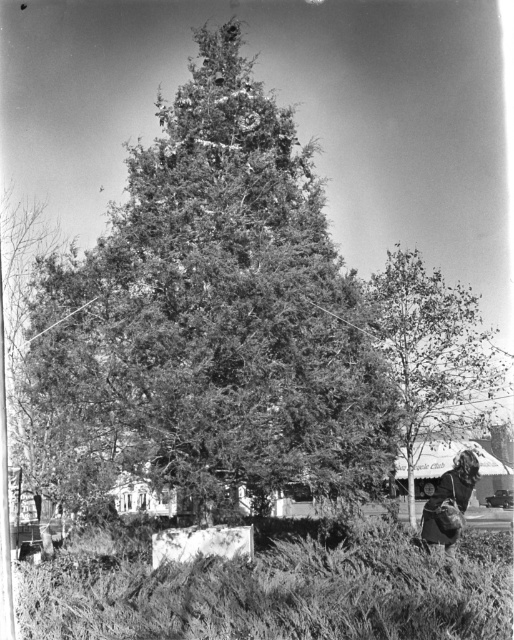
In the black and white photo, there is a smooth green tree at right and a dark hair at lower right. From the perspective of someone standing in front of the tree, which object is positioned to the right side?

The smooth green tree at right is positioned to the right of the dark hair at lower right.